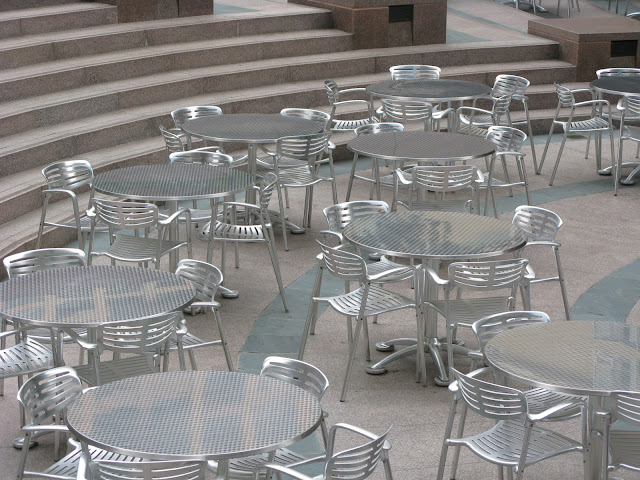
Locate an element on the screen. The image size is (640, 480). table 7 chairs is located at coordinates (388, 129), (497, 128), (456, 182).